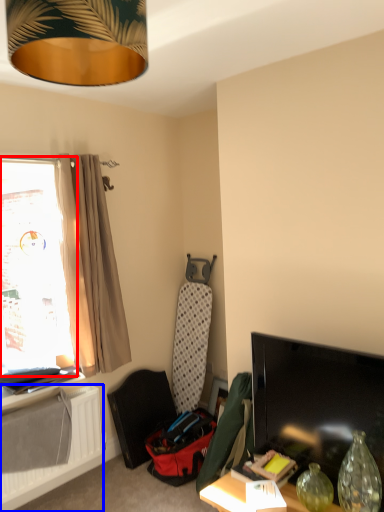
Question: Which of the following is the closest to the observer, window (highlighted by a red box) or radiator (highlighted by a blue box)?

Choices:
 (A) window
 (B) radiator

Answer: (B)